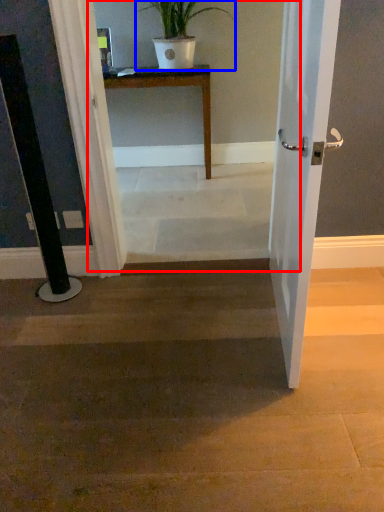
Question: Which object is further to the camera taking this photo, corridor (highlighted by a red box) or houseplant (highlighted by a blue box)?

Choices:
 (A) corridor
 (B) houseplant

Answer: (B)